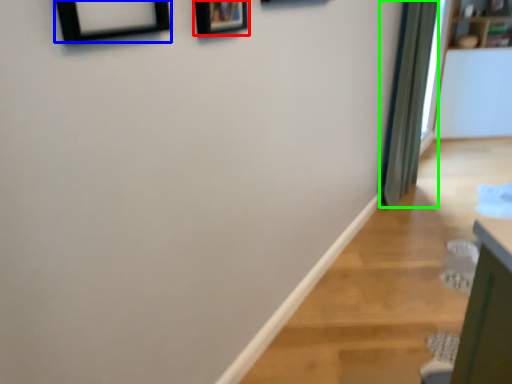
Question: Which object is the farthest from picture frame (highlighted by a red box)? Choose among these: picture frame (highlighted by a blue box) or curtain (highlighted by a green box).

Choices:
 (A) picture frame
 (B) curtain

Answer: (B)